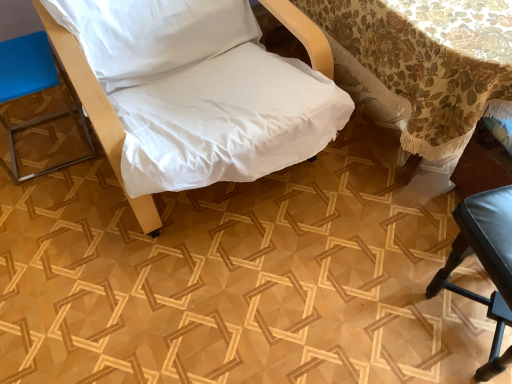
What are the coordinates of `free space between black leather chair at lower right, placed as the third furniture when sorted from left to right, and blue leather stool at left, the 1th furniture when ordered from left to right` in the screenshot? It's located at (267, 241).